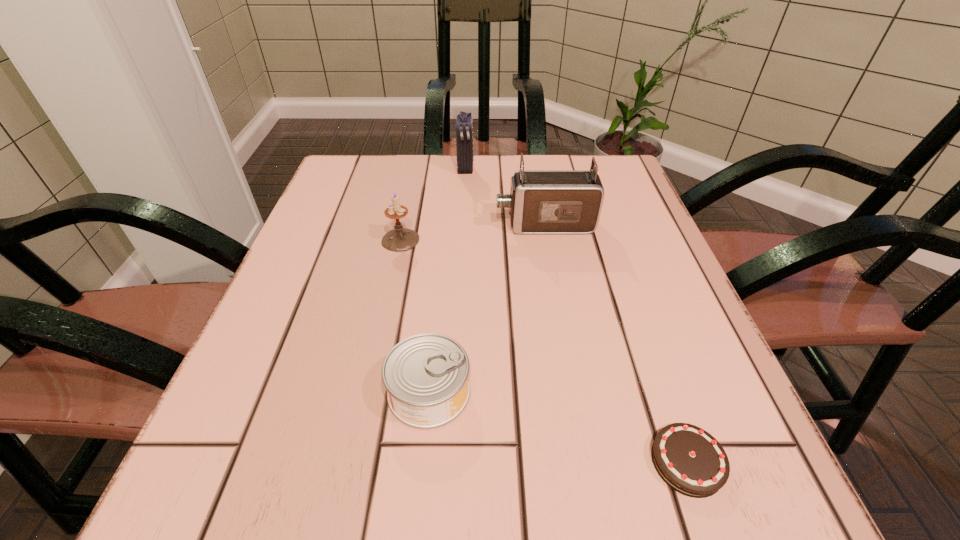
You are a GUI agent. You are given a task and a screenshot of the screen. Output one action in this format:
    pyautogui.click(x=<x>, y=<y>)
    Task: Click on the free space between the chocolate cake and the second shortest object
    The width and height of the screenshot is (960, 540).
    Given the screenshot: What is the action you would take?
    pyautogui.click(x=558, y=427)

You are a GUI agent. You are given a task and a screenshot of the screen. Output one action in this format:
    pyautogui.click(x=<x>, y=<y>)
    Task: Click on the free space between the chocolate cake and the farthest object
    The height and width of the screenshot is (540, 960).
    Given the screenshot: What is the action you would take?
    pyautogui.click(x=576, y=315)

Locate an element on the screen. Image resolution: width=960 pixels, height=540 pixels. free area in between the can and the chocolate cake is located at coordinates (558, 427).

Locate an element on the screen. Image resolution: width=960 pixels, height=540 pixels. object that is the closest one to the can is located at coordinates (691, 461).

You are a GUI agent. You are given a task and a screenshot of the screen. Output one action in this format:
    pyautogui.click(x=<x>, y=<y>)
    Task: Click on the object that stands as the closest to the camcorder
    
    Given the screenshot: What is the action you would take?
    pyautogui.click(x=399, y=239)

This screenshot has width=960, height=540. Find the location of `blank space that satisfies the following two spatial constraints: 1. on the front side of the candle holder; 2. on the left side of the shortest object`. blank space that satisfies the following two spatial constraints: 1. on the front side of the candle holder; 2. on the left side of the shortest object is located at coordinates (353, 462).

Locate an element on the screen. The width and height of the screenshot is (960, 540). free space that satisfies the following two spatial constraints: 1. with the zip open on the farthest object; 2. on the right side of the shortest object is located at coordinates (451, 462).

You are a GUI agent. You are given a task and a screenshot of the screen. Output one action in this format:
    pyautogui.click(x=<x>, y=<y>)
    Task: Click on the vacant space that satisfies the following two spatial constraints: 1. on the front side of the chocolate cake; 2. on the left side of the candle holder
    
    Given the screenshot: What is the action you would take?
    pyautogui.click(x=353, y=462)

Locate an element on the screen. vacant space that satisfies the following two spatial constraints: 1. with the zip open on the farthest object; 2. on the left side of the shortest object is located at coordinates 451,462.